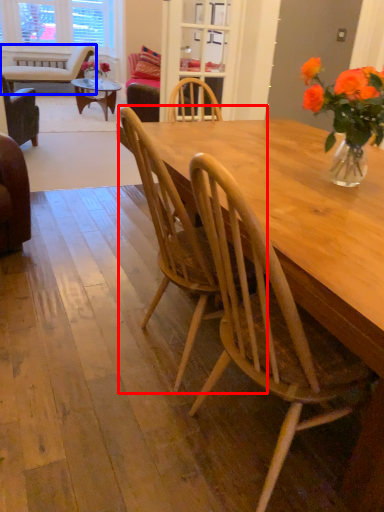
Question: Which object appears farthest to the camera in this image, chair (highlighted by a red box) or chair (highlighted by a blue box)?

Choices:
 (A) chair
 (B) chair

Answer: (B)